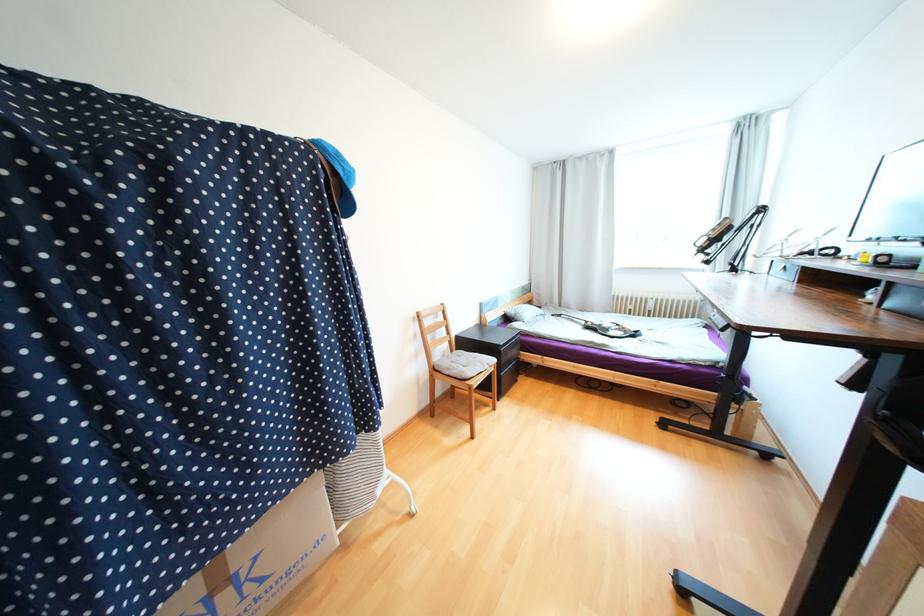
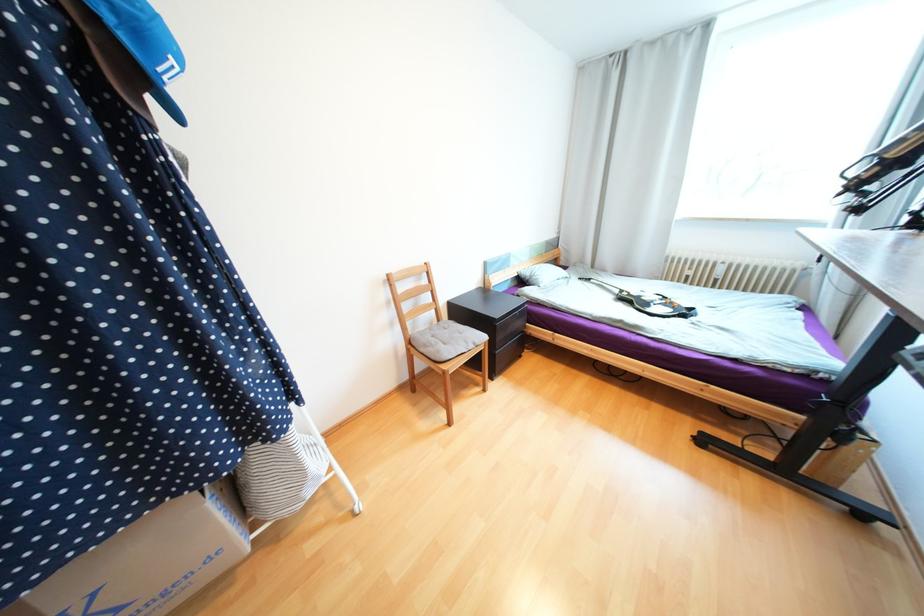
Question: The images are taken continuously from a first-person perspective. In which direction is your viewpoint rotating?

Choices:
 (A) Left
 (B) Right
 (C) Up
 (D) Down

Answer: (D)